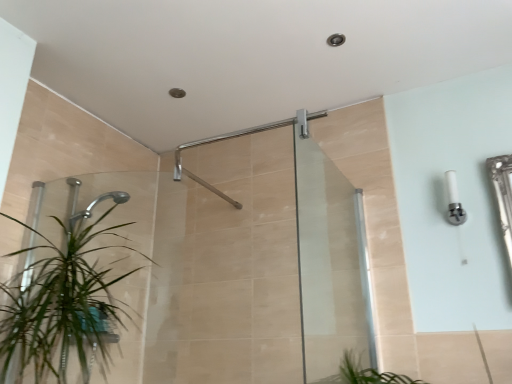
Question: Is green leafy plant at left to the left of transparent glass screen door at center from the viewer's perspective?

Choices:
 (A) yes
 (B) no

Answer: (A)

Question: Are green leafy plant at left and transparent glass screen door at center beside each other?

Choices:
 (A) no
 (B) yes

Answer: (A)

Question: From a real-world perspective, is green leafy plant at left located beneath transparent glass screen door at center?

Choices:
 (A) yes
 (B) no

Answer: (A)

Question: Is green leafy plant at left facing away from transparent glass screen door at center?

Choices:
 (A) no
 (B) yes

Answer: (A)

Question: Is green leafy plant at left positioned beyond the bounds of transparent glass screen door at center?

Choices:
 (A) yes
 (B) no

Answer: (A)

Question: Considering the relative sizes of green leafy plant at left and transparent glass screen door at center in the image provided, is green leafy plant at left wider than transparent glass screen door at center?

Choices:
 (A) yes
 (B) no

Answer: (A)

Question: Is green leafy plant at left beside matte silver shower arm at upper center?

Choices:
 (A) no
 (B) yes

Answer: (A)

Question: Does green leafy plant at left come in front of matte silver shower arm at upper center?

Choices:
 (A) no
 (B) yes

Answer: (B)

Question: Does green leafy plant at left contain matte silver shower arm at upper center?

Choices:
 (A) no
 (B) yes

Answer: (A)

Question: Is green leafy plant at left facing towards matte silver shower arm at upper center?

Choices:
 (A) no
 (B) yes

Answer: (A)

Question: Is green leafy plant at left bigger than matte silver shower arm at upper center?

Choices:
 (A) no
 (B) yes

Answer: (B)

Question: Considering the relative positions of green leafy plant at left and matte silver shower arm at upper center in the image provided, is green leafy plant at left to the right of matte silver shower arm at upper center from the viewer's perspective?

Choices:
 (A) yes
 (B) no

Answer: (B)

Question: Is transparent glass screen door at center located within matte silver shower arm at upper center?

Choices:
 (A) yes
 (B) no

Answer: (B)